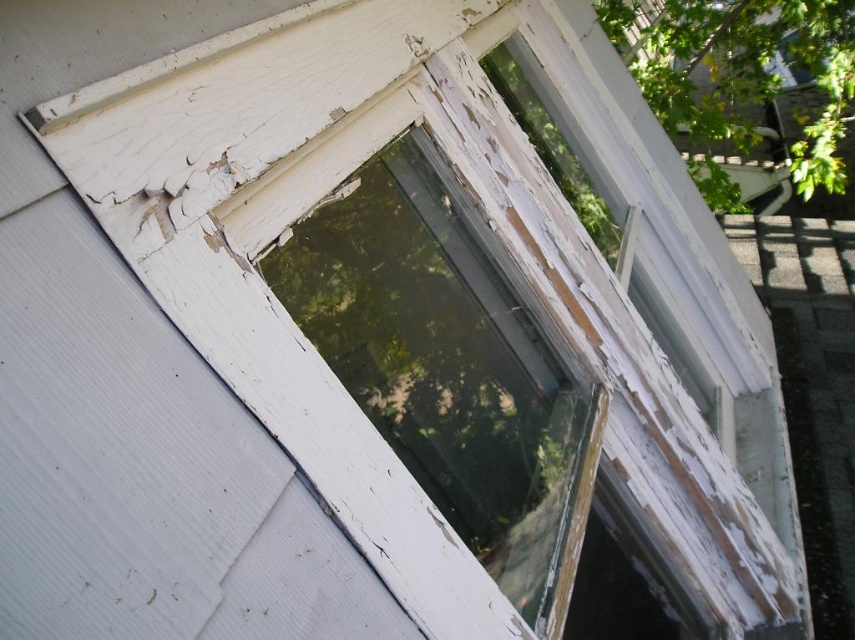
You are an interior designer assessing the space in the image. You need to determine if the transparent glass window at center can accommodate a large decorative sticker that covers half the window. Considering the size of the window relative to the green leafy tree at upper right, what should you consider?

The transparent glass window at center is smaller in size compared to the green leafy tree at upper right, so the sticker covering half the window may be appropriate as the window itself is not overly large. However, the exact feasibility would depend on the sticker size relative to the window dimensions.

You are a painter standing in front of the window frame on the white wall. You notice two points marked on the wall. The first point is at coordinate point(x=532, y=428) and the second is at point(x=781, y=33). If you want to paint the point that is closer to you, which point should you choose?

Point(x=532, y=428) is in front of point(x=781, y=33), so you should choose point(x=532, y=428) to paint since it is closer to you.

You are standing in front of the weathered window frame. You want to see the green leafy tree at upper right clearly through the transparent glass window at center. Is the tree visible through the window?

The transparent glass window at center is in front of the green leafy tree at upper right, so the tree is visible through the window.